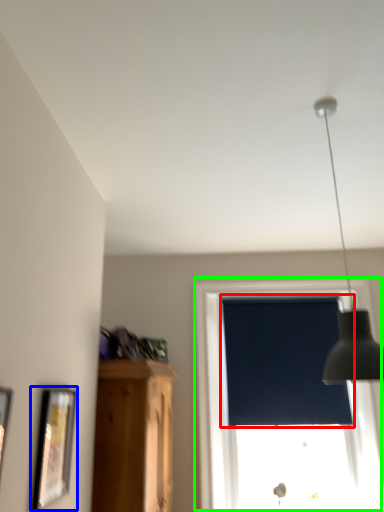
Question: Which object is the closest to the window screen (highlighted by a red box)? Choose among these: picture frame (highlighted by a blue box) or window (highlighted by a green box).

Choices:
 (A) picture frame
 (B) window

Answer: (B)